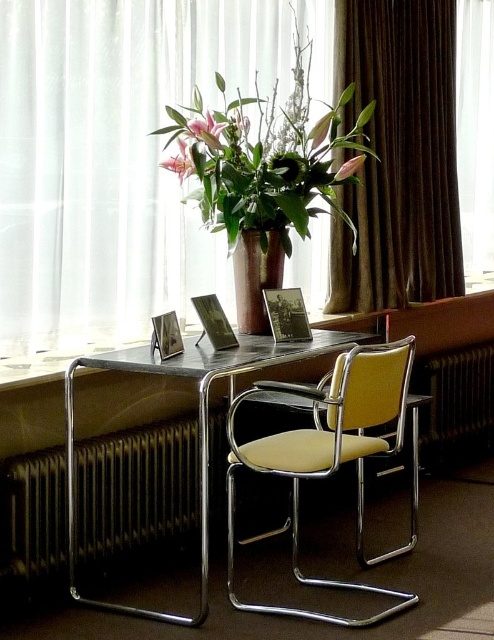
You are standing in the room and want to move from point A to point B. Point A is at coordinate point (x=306, y=448) and point B is at coordinate point (x=466, y=3). Which point is closer to you?

Point A at coordinate point (x=306, y=448) is closer to you than point B at coordinate point (x=466, y=3).

You are standing at the entrance of the room and want to sit down. There is a beige leather swivel chair at center located at point (x=328, y=451). Is there any furniture between you and the chair?

Yes, there is a table with three framed photographs in front of you between you and the beige leather swivel chair at center located at point (x=328, y=451).

Based on the photo, you are arranging flowers in the matte brown vase at center and need to ensure it stays visible from the entrance. The brown velvet curtain at right is currently blocking part of the vase. Which object should be moved to improve visibility?

The brown velvet curtain at right should be moved to the side to allow better visibility of the matte brown vase at center since the curtain is positioned on the right side of the vase and is blocking its view.